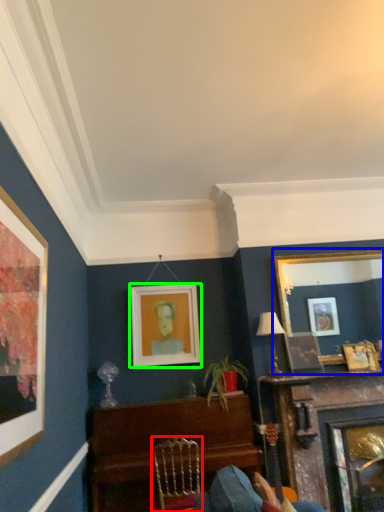
Question: Considering the real-world distances, which object is closest to chair (highlighted by a red box)? picture frame (highlighted by a blue box) or picture frame (highlighted by a green box).

Choices:
 (A) picture frame
 (B) picture frame

Answer: (B)